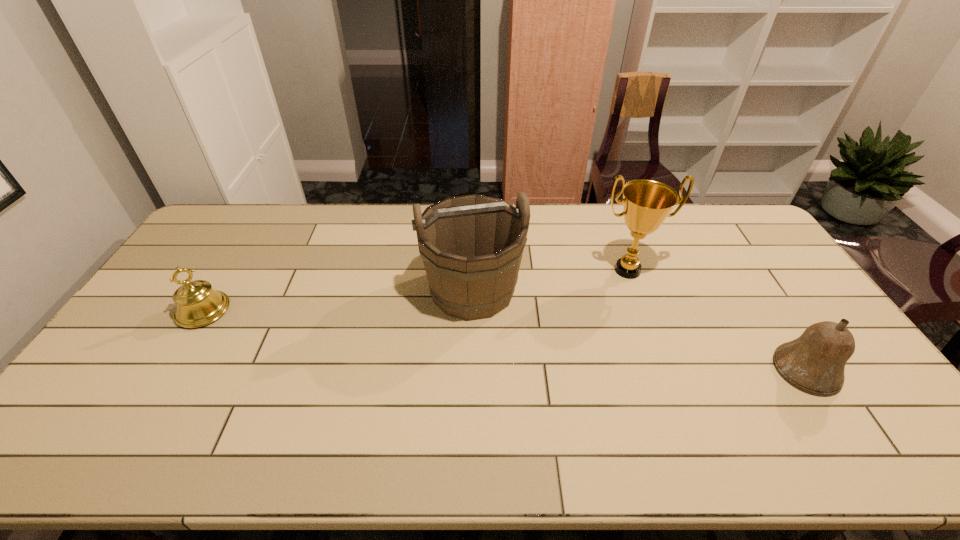
Find the location of a particular element. object that is at the left edge is located at coordinates (198, 304).

Where is `object positioned at the right edge`? object positioned at the right edge is located at coordinates (815, 361).

This screenshot has height=540, width=960. I want to click on vacant space at the far edge, so click(265, 206).

At what (x,y) coordinates should I click in order to perform the action: click on free space at the near edge of the desktop. Please return your answer as a coordinate pair (x, y). This screenshot has width=960, height=540. Looking at the image, I should click on (443, 451).

The width and height of the screenshot is (960, 540). I want to click on blank space at the left edge of the desktop, so click(110, 354).

In order to click on vacant space at the right edge in this screenshot , I will do `click(790, 276)`.

Identify the location of vacant space at the near left corner of the desktop. Image resolution: width=960 pixels, height=540 pixels. 65,443.

The height and width of the screenshot is (540, 960). Find the location of `vacant area at the far right corner`. vacant area at the far right corner is located at coordinates (722, 215).

This screenshot has height=540, width=960. What are the coordinates of `free space between the bucket and the award` in the screenshot? It's located at [x=550, y=280].

Find the location of a particular element. This screenshot has width=960, height=540. free spot between the farther bell and the award is located at coordinates (416, 291).